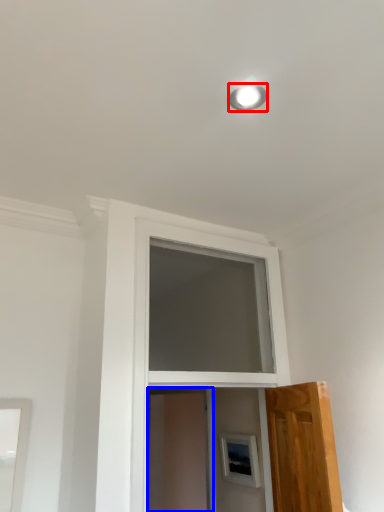
Question: Which object appears closest to the camera in this image, lighting (highlighted by a red box) or screen door (highlighted by a blue box)?

Choices:
 (A) lighting
 (B) screen door

Answer: (A)